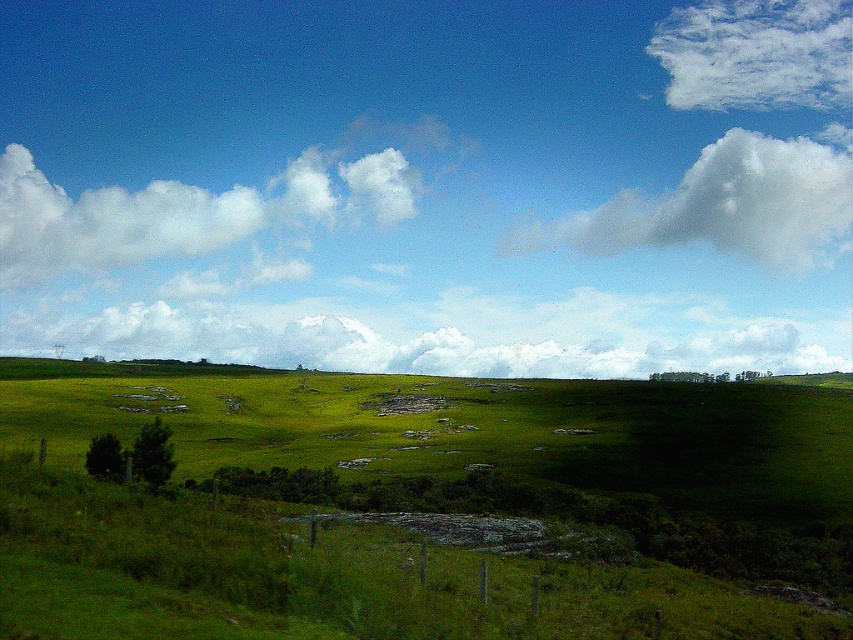
Question: Can you confirm if white fluffy cloud at center is smaller than white fluffy cloud at upper right?

Choices:
 (A) no
 (B) yes

Answer: (A)

Question: Is white fluffy cloud at upper center closer to the viewer compared to white fluffy cloud at upper left?

Choices:
 (A) no
 (B) yes

Answer: (B)

Question: Which point is farther from the camera taking this photo?

Choices:
 (A) (142, 257)
 (B) (804, 220)

Answer: (B)

Question: Based on their relative distances, which object is farther from the white fluffy cloud at upper right?

Choices:
 (A) white fluffy cloud at upper center
 (B) white fluffy cloud at upper left
 (C) white fluffy cloud at center

Answer: (B)

Question: Does white fluffy cloud at center appear on the right side of white fluffy cloud at upper center?

Choices:
 (A) yes
 (B) no

Answer: (B)

Question: Which of the following is the closest to the observer?

Choices:
 (A) white fluffy cloud at upper left
 (B) white fluffy cloud at upper center
 (C) white fluffy cloud at upper right

Answer: (B)